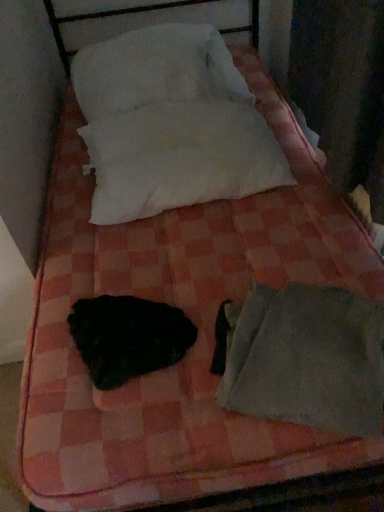
Question: Is the depth of gray fabric sleeping bag at lower right greater than that of black fuzzy animal at center?

Choices:
 (A) yes
 (B) no

Answer: (B)

Question: Is gray fabric sleeping bag at lower right positioned far away from black fuzzy animal at center?

Choices:
 (A) no
 (B) yes

Answer: (A)

Question: Does gray fabric sleeping bag at lower right have a lesser height compared to black fuzzy animal at center?

Choices:
 (A) no
 (B) yes

Answer: (A)

Question: Is gray fabric sleeping bag at lower right at the left side of black fuzzy animal at center?

Choices:
 (A) yes
 (B) no

Answer: (B)

Question: Can black fuzzy animal at center be found inside gray fabric sleeping bag at lower right?

Choices:
 (A) yes
 (B) no

Answer: (B)

Question: Is white cotton pillow at upper center, the 1th pillow when ordered from bottom to top, in front of or behind white soft pillow at upper center, positioned as the 1th pillow in top-to-bottom order, in the image?

Choices:
 (A) front
 (B) behind

Answer: (A)

Question: In the image, is white cotton pillow at upper center, the 1th pillow when ordered from bottom to top, on the left side or the right side of white soft pillow at upper center, positioned as the 1th pillow in top-to-bottom order?

Choices:
 (A) right
 (B) left

Answer: (A)

Question: Is white cotton pillow at upper center, the 2th pillow from the top, wider or thinner than white soft pillow at upper center, positioned as the 1th pillow in top-to-bottom order?

Choices:
 (A) thin
 (B) wide

Answer: (A)

Question: In terms of size, does white cotton pillow at upper center, the 2th pillow from the top, appear bigger or smaller than white soft pillow at upper center, positioned as the 1th pillow in top-to-bottom order?

Choices:
 (A) big
 (B) small

Answer: (B)

Question: Do you think black fuzzy animal at center is within white soft pillow at upper center, positioned as the 1th pillow in top-to-bottom order, or outside of it?

Choices:
 (A) outside
 (B) inside

Answer: (A)

Question: Is point (170, 306) closer or farther from the camera than point (198, 99)?

Choices:
 (A) closer
 (B) farther

Answer: (A)

Question: From the image's perspective, is black fuzzy animal at center above or below white soft pillow at upper center, positioned as the second pillow in bottom-to-top order?

Choices:
 (A) above
 (B) below

Answer: (B)

Question: Is black fuzzy animal at center taller or shorter than white soft pillow at upper center, positioned as the 1th pillow in top-to-bottom order?

Choices:
 (A) short
 (B) tall

Answer: (A)

Question: In the image, is white cotton pillow at upper center, the 1th pillow when ordered from bottom to top, on the left side or the right side of black fuzzy animal at center?

Choices:
 (A) left
 (B) right

Answer: (B)

Question: Do you think white cotton pillow at upper center, the 1th pillow when ordered from bottom to top, is within black fuzzy animal at center, or outside of it?

Choices:
 (A) inside
 (B) outside

Answer: (B)